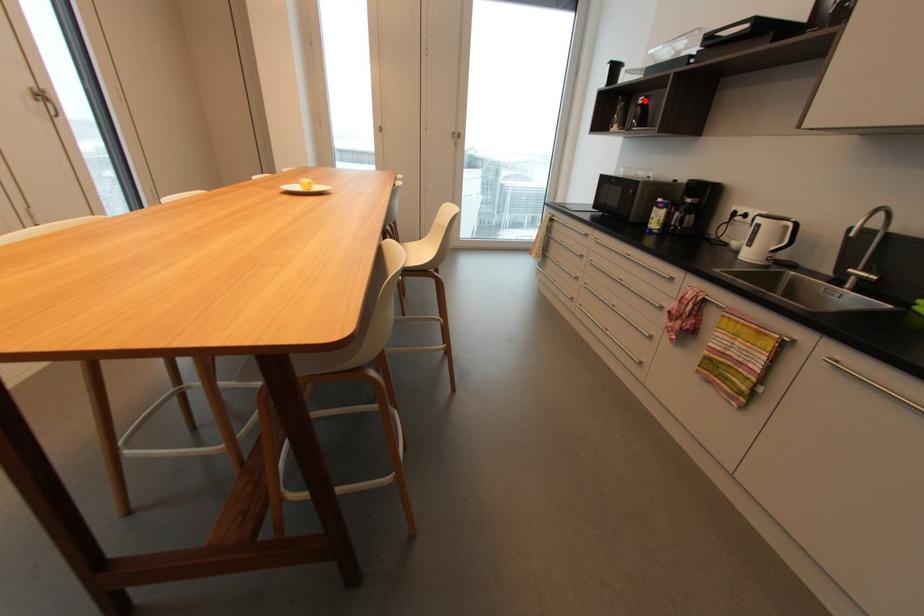
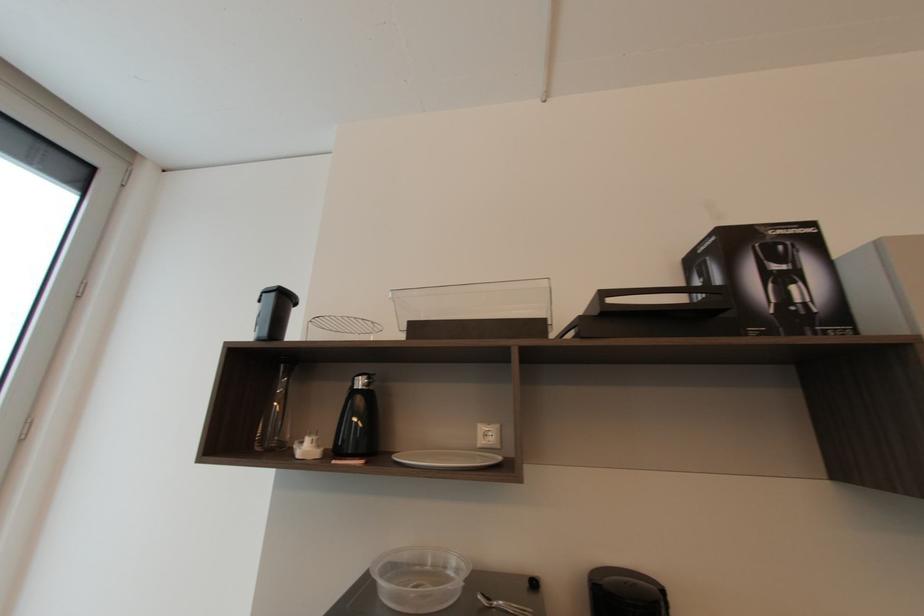
Where in the second image is the point corresponding to the highlighted location from the first image?

(362, 384)